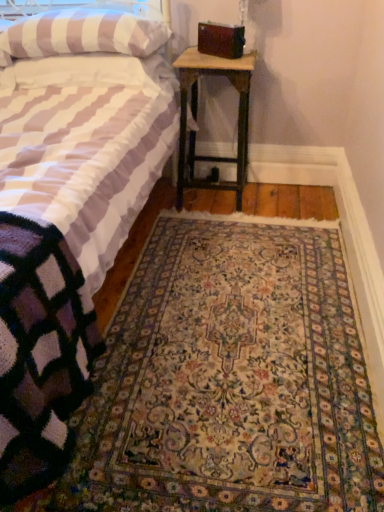
Locate an element on the screen. Image resolution: width=384 pixels, height=512 pixels. free space in front of wooden nightstand at lower right is located at coordinates (237, 220).